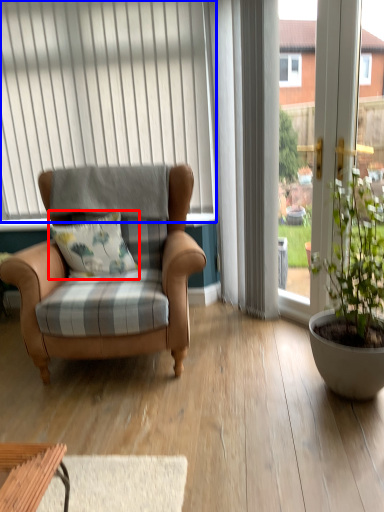
Question: Among these objects, which one is nearest to the camera, pillow (highlighted by a red box) or curtain (highlighted by a blue box)?

Choices:
 (A) pillow
 (B) curtain

Answer: (A)